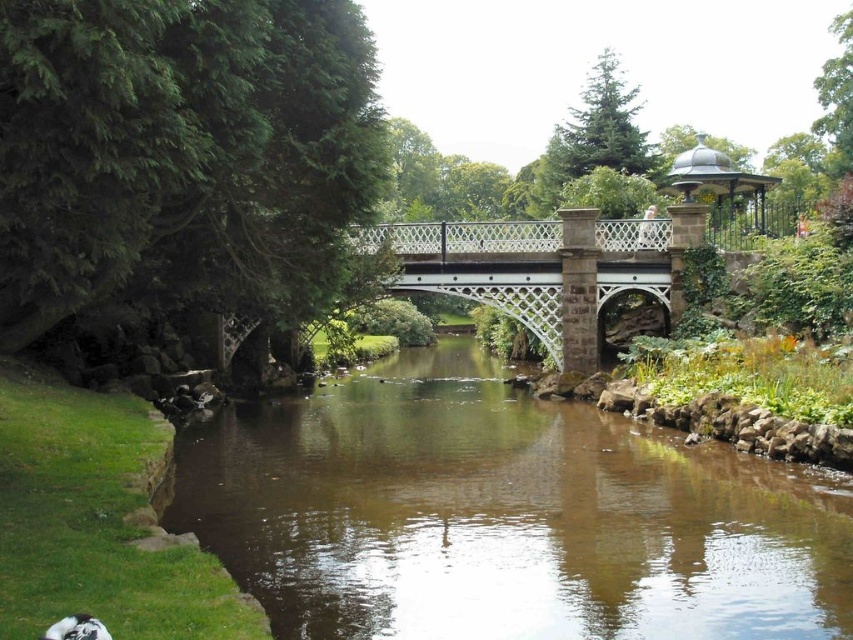
Question: Which of the following is the farthest from the observer?

Choices:
 (A) white metal bridge at center
 (B) brown smooth water at center

Answer: (A)

Question: Does white metal bridge at center appear under polished metal gazebo at upper right?

Choices:
 (A) no
 (B) yes

Answer: (B)

Question: Which point is closer to the camera taking this photo?

Choices:
 (A) (585, 486)
 (B) (718, 180)
 (C) (531, 240)

Answer: (A)

Question: Is white metal bridge at center positioned behind polished metal gazebo at upper right?

Choices:
 (A) no
 (B) yes

Answer: (A)

Question: Is white metal bridge at center below polished metal gazebo at upper right?

Choices:
 (A) no
 (B) yes

Answer: (B)

Question: Which of the following is the closest to the observer?

Choices:
 (A) (712, 557)
 (B) (601, 256)

Answer: (A)